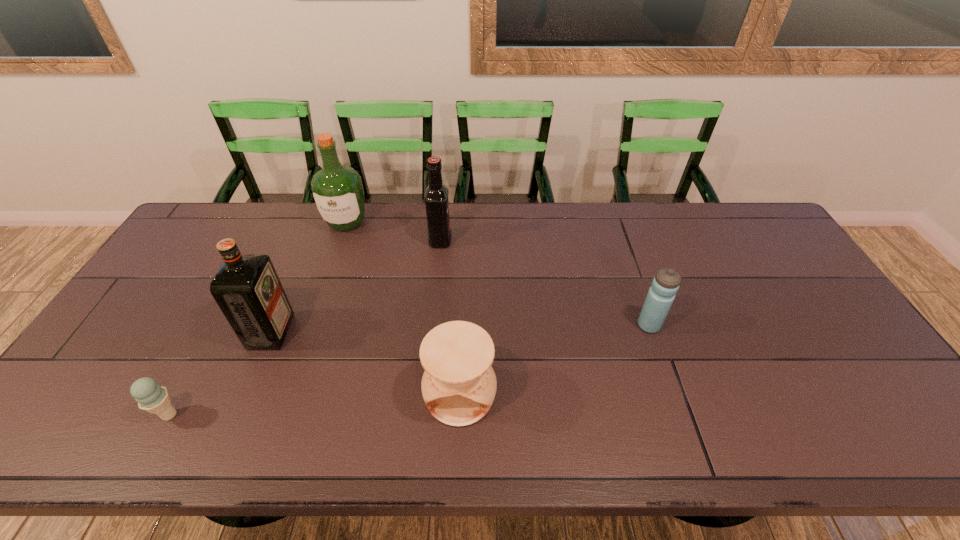
This screenshot has height=540, width=960. I want to click on vacant area situated on the back of the leftmost object, so click(x=224, y=314).

Image resolution: width=960 pixels, height=540 pixels. What are the coordinates of `pottery positioned at the near edge` in the screenshot? It's located at (459, 384).

Locate an element on the screen. ice cream at the near edge is located at coordinates click(151, 397).

Image resolution: width=960 pixels, height=540 pixels. I want to click on free spot at the far edge of the desktop, so click(273, 204).

The width and height of the screenshot is (960, 540). I want to click on free region at the near edge of the desktop, so click(x=786, y=437).

Identify the location of vacant space at the left edge. The height and width of the screenshot is (540, 960). (134, 305).

Find the location of a particular element. The height and width of the screenshot is (540, 960). vacant position at the right edge of the desktop is located at coordinates (825, 356).

What are the coordinates of `vacant point located between the pottery and the rightmost liquor` in the screenshot? It's located at 450,318.

The height and width of the screenshot is (540, 960). What are the coordinates of `free space between the nearest liquor and the shortest object` in the screenshot? It's located at (220, 373).

I want to click on vacant region between the shortest object and the rightmost liquor, so click(x=305, y=327).